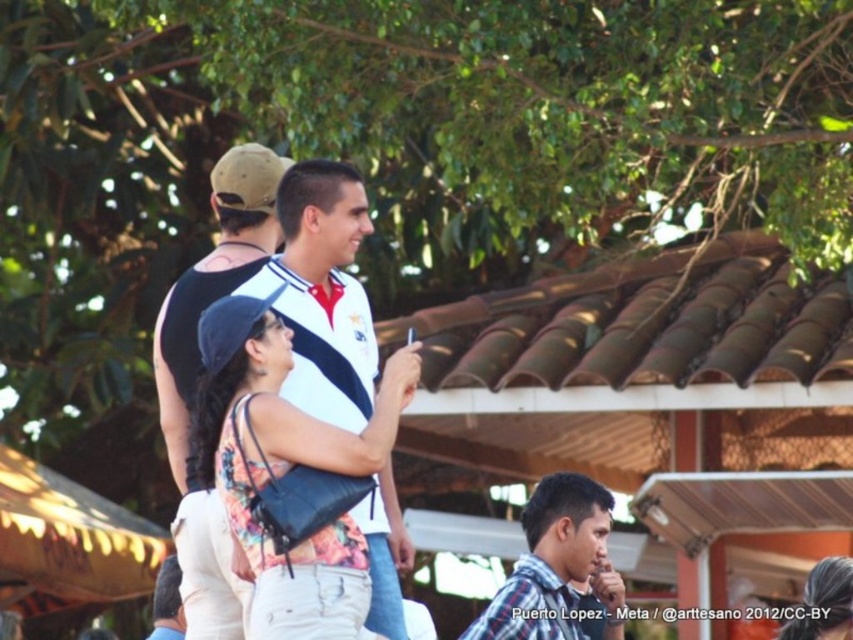
Question: Can you confirm if floral fabric top at center is smaller than black matte tank top at center?

Choices:
 (A) no
 (B) yes

Answer: (B)

Question: Which point is farther to the camera?

Choices:
 (A) (349, 448)
 (B) (613, 593)

Answer: (B)

Question: Which object is closer to the camera taking this photo?

Choices:
 (A) floral fabric top at center
 (B) plaid cotton shirt at center

Answer: (A)

Question: Is floral fabric top at center above black matte tank top at center?

Choices:
 (A) no
 (B) yes

Answer: (A)

Question: Which point is farther from the camera taking this photo?

Choices:
 (A) (262, 428)
 (B) (534, 620)
 (C) (169, 332)

Answer: (B)

Question: Is black matte tank top at center in front of plaid cotton shirt at center?

Choices:
 (A) no
 (B) yes

Answer: (B)